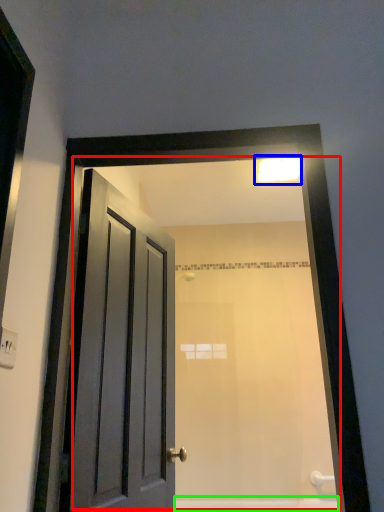
Question: Estimate the real-world distances between objects in this image. Which object is farther from mirror (highlighted by a red box), light fixture (highlighted by a blue box) or bath (highlighted by a green box)?

Choices:
 (A) light fixture
 (B) bath

Answer: (B)